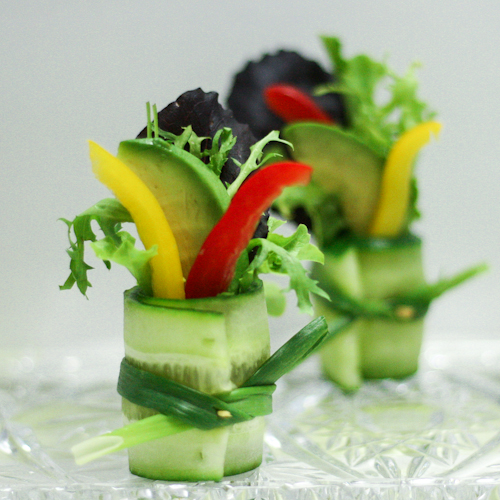
I want to click on glass plate, so click(354, 469).